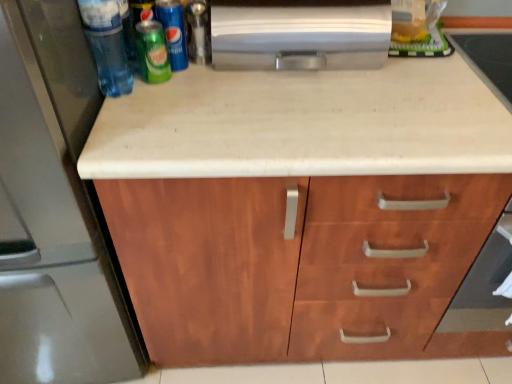
The height and width of the screenshot is (384, 512). What are the coordinates of `free space in front of silver metallic paper towel holder at upper center` in the screenshot? It's located at (309, 117).